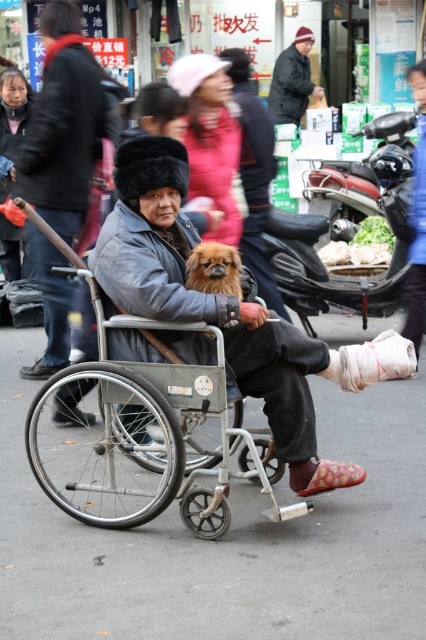
You are a delivery person who needs to navigate through the street scene shown in the image. The metallic gray wheelchair at center is located at coordinates 0.694, 0.338. Can you safely pass around it without getting too close?

The metallic gray wheelchair at center is positioned at coordinates (143, 444). Since the wheelchair is at the center of the scene, there should be enough space to navigate around it safely by moving either to the left or right side, maintaining a respectful distance.

You are a delivery person who needs to park your scooter near the metallic red motorcycle at right. The parking area requires vehicles to be within 20 feet of each other. Is your scooter currently within the required distance?

The metallic red motorcycle at right is 22.43 feet away from the camera, which is beyond the 20 feet requirement. Therefore, the scooter is not within the required distance.

You are a delivery person who needs to navigate through the street scene. There is a dark gray fabric coat at center and a dark gray fabric jacket at center in your path. Can you pass between them without touching either?

The distance between the dark gray fabric coat at center and the dark gray fabric jacket at center is 9.36 feet, which is sufficient for a delivery person to pass through without touching either.